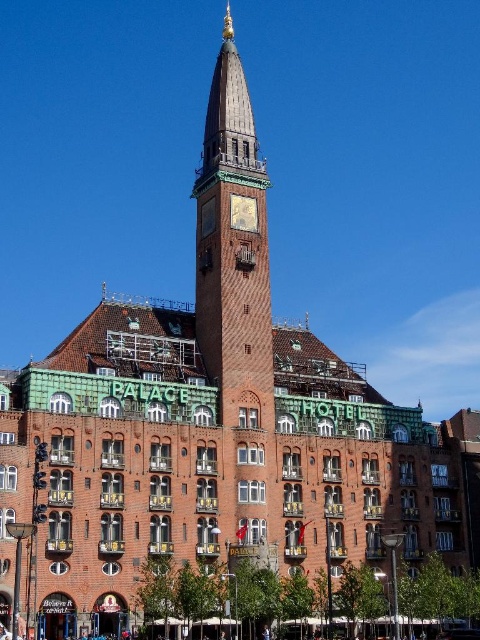
Can you confirm if brown textured clock tower at center is positioned above goldmetallicclock at center?

Yes.

Is brown textured clock tower at center bigger than goldmetallicclock at center?

Correct, brown textured clock tower at center is larger in size than goldmetallicclock at center.

Who is more distant from viewer, (x=241, y=108) or (x=240, y=216)?

Positioned behind is point (x=241, y=108).

The height and width of the screenshot is (640, 480). In order to click on brown textured clock tower at center in this screenshot , I will do `click(232, 252)`.